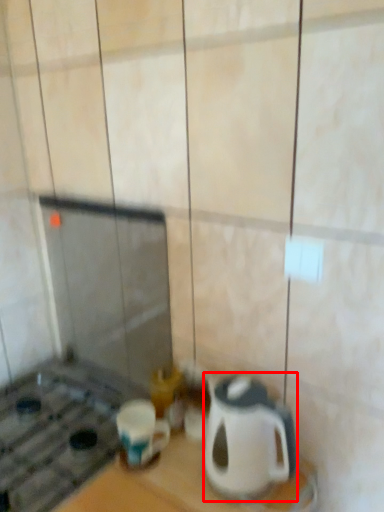
Question: From the image's perspective, considering the relative positions of kitchen appliance (annotated by the red box) and coffee cup in the image provided, where is kitchen appliance (annotated by the red box) located with respect to the staircase?

Choices:
 (A) below
 (B) above

Answer: (B)